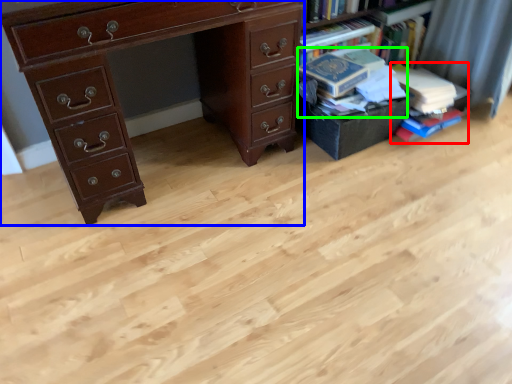
Question: Estimate the real-world distances between objects in this image. Which object is farther from book (highlighted by a red box), chest of drawers (highlighted by a blue box) or book (highlighted by a green box)?

Choices:
 (A) chest of drawers
 (B) book

Answer: (A)